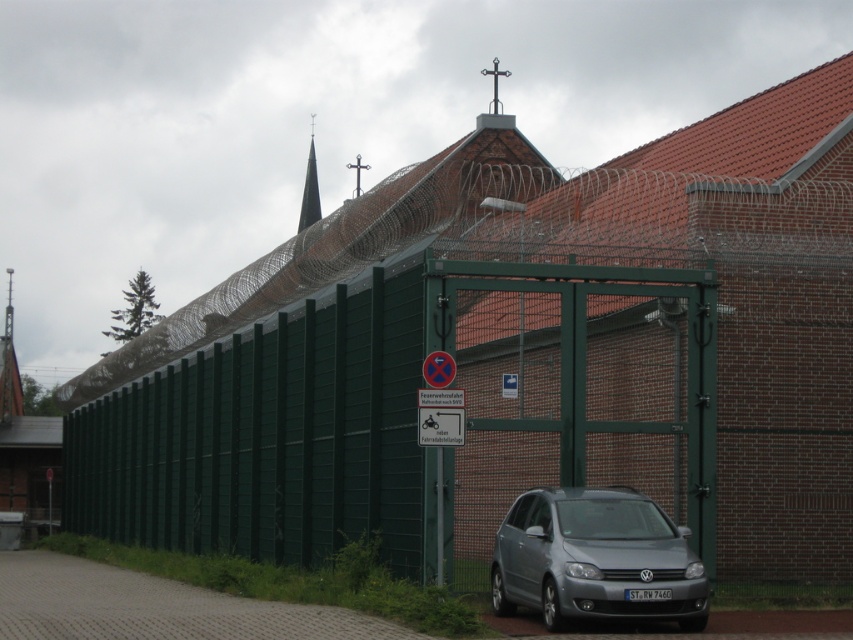
You are standing in front of the fortified structure and want to determine the relative positions of two points marked on the image. Which point is closer to you, point 1 at coordinates (518, 602) or point 2 at coordinates (315, 177)?

Point 1 at coordinates (518, 602) is closer to the viewer than point 2 at coordinates (315, 177).

You are a delivery driver who needs to enter the facility through the gate. The guard tells you that you must not block the steeple from view when parking. Can you park the satin silver car at lower center without hiding the smooth gray steeple at upper center?

The satin silver car at lower center is below the smooth gray steeple at upper center, so parking it would block the view of the steeple. Therefore, you cannot park the satin silver car at lower center without hiding the smooth gray steeple at upper center.

You are a delivery driver who needs to enter the facility through the gate. Your vehicle is the satin silver car at lower center. The facility has a strict rule that only vehicles narrower than the smooth gray steeple at upper center can pass through the entrance. Can your vehicle pass through the gate?

The satin silver car at lower center has a width less than the smooth gray steeple at upper center, so yes, the vehicle can pass through the gate as it meets the facility requirement.